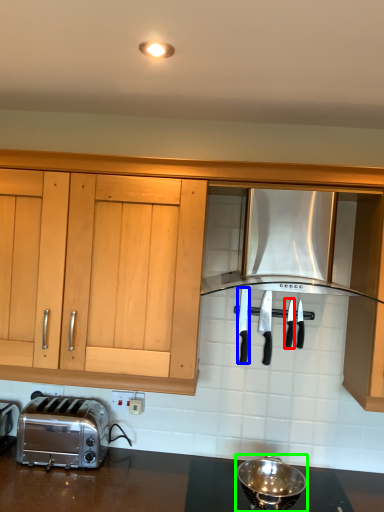
Question: Considering the real-world distances, which object is closest to silverware (highlighted by a red box)? silverware (highlighted by a blue box) or appliance (highlighted by a green box).

Choices:
 (A) silverware
 (B) appliance

Answer: (A)